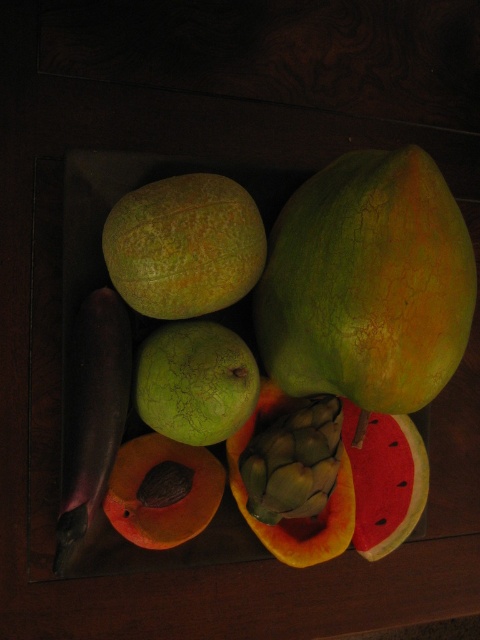
Is green cracked melon at center bigger than smooth orange papaya at center?

Yes.

Is point (173, 372) more distant than point (169, 445)?

That is False.

Is point (183, 355) closer to viewer compared to point (163, 509)?

Yes, point (183, 355) is closer to viewer.

The width and height of the screenshot is (480, 640). I want to click on green cracked melon at center, so click(x=194, y=381).

Which of these two, green matte melon at center or green cracked melon at center, stands taller?

green matte melon at center

Does green matte melon at center appear under green cracked melon at center?

No.

What are the coordinates of `green matte melon at center` in the screenshot? It's located at (183, 244).

Find the location of a particular element. green matte melon at center is located at coordinates click(183, 244).

Is point (324, 376) behind point (192, 348)?

Yes, it is behind point (192, 348).

Does green rough papaya at upper right have a lesser width compared to green cracked melon at center?

Incorrect, green rough papaya at upper right's width is not less than green cracked melon at center's.

Locate an element on the screen. The width and height of the screenshot is (480, 640). green rough papaya at upper right is located at coordinates (368, 284).